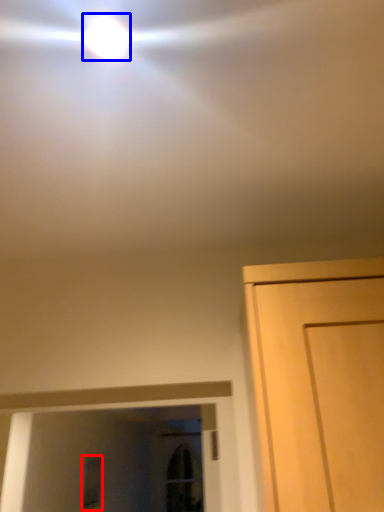
Question: Among these objects, which one is farthest to the camera, window (highlighted by a red box) or droplight (highlighted by a blue box)?

Choices:
 (A) window
 (B) droplight

Answer: (A)